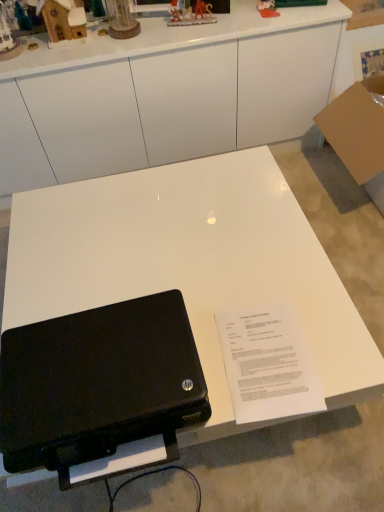
What are the coordinates of `vacant area that lies between matte wooden clock at upper center, the third toy when ordered from left to right, and metallic silver sleigh at upper center, the 4th toy in the left-to-right sequence` in the screenshot? It's located at (162, 27).